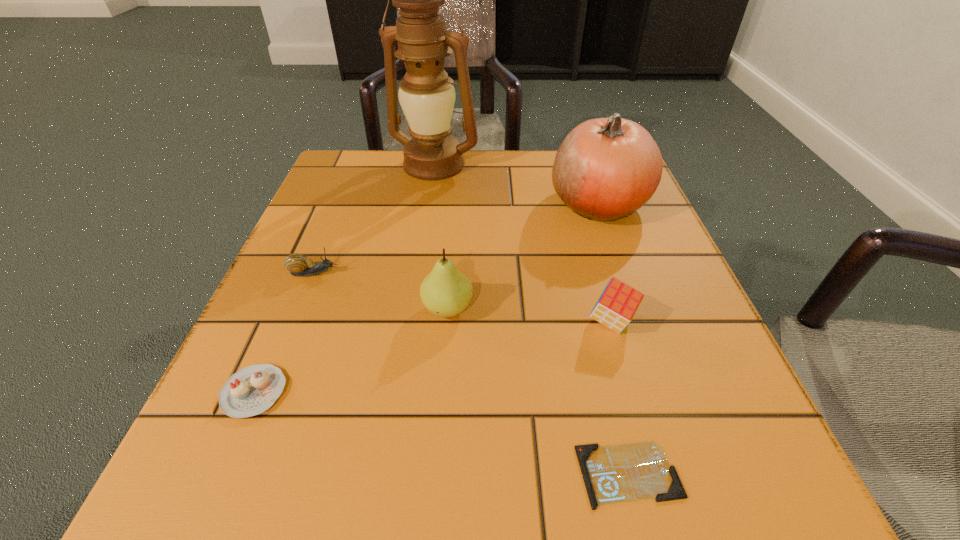
The height and width of the screenshot is (540, 960). Find the location of `oil lamp located in the left edge section of the desktop`. oil lamp located in the left edge section of the desktop is located at coordinates (426, 94).

At what (x,y) coordinates should I click in order to perform the action: click on escargot present at the left edge. Please return your answer as a coordinate pair (x, y). Looking at the image, I should click on (299, 265).

In order to click on cupcake situated at the left edge in this screenshot , I will do `click(252, 390)`.

You are a GUI agent. You are given a task and a screenshot of the screen. Output one action in this format:
    pyautogui.click(x=<x>, y=<y>)
    Task: Click on the pumpkin situated at the right edge
    
    Given the screenshot: What is the action you would take?
    pyautogui.click(x=606, y=168)

In order to click on cube located in the right edge section of the desktop in this screenshot , I will do `click(618, 303)`.

This screenshot has width=960, height=540. Find the location of `identity card at the right edge`. identity card at the right edge is located at coordinates (620, 473).

The height and width of the screenshot is (540, 960). What are the coordinates of `object that is at the far left corner` in the screenshot? It's located at (426, 94).

Locate an element on the screen. object that is at the far right corner is located at coordinates (606, 168).

Locate an element on the screen. object located at the near right corner is located at coordinates (620, 473).

Identify the location of free space at the far edge. The image size is (960, 540). (479, 183).